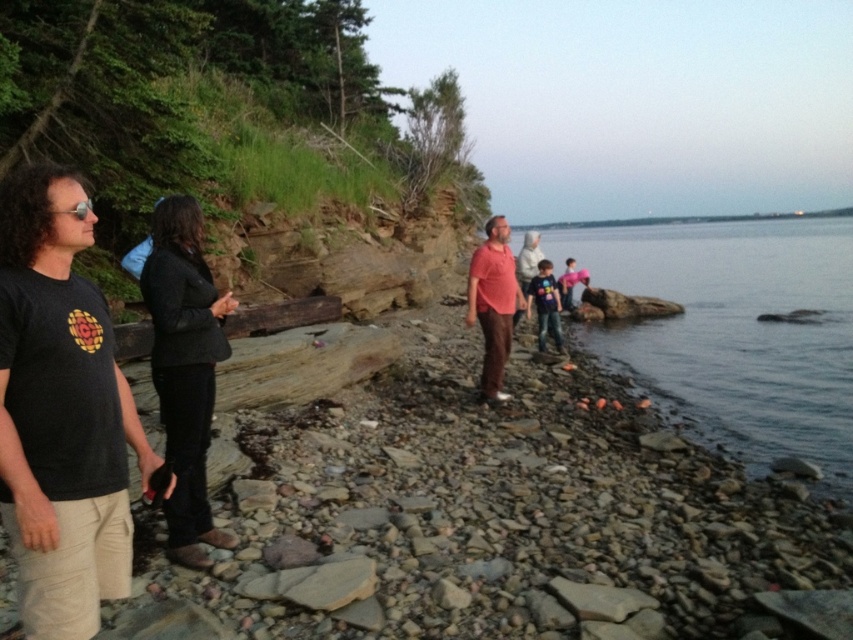
Question: Observing the image, what is the correct spatial positioning of clear water at lower right in reference to black wool jacket at left?

Choices:
 (A) below
 (B) above

Answer: (B)

Question: Which object is closer to the camera taking this photo?

Choices:
 (A) pink fabric at center
 (B) clear water at lower right
 (C) dark blue t-shirt at center
 (D) matte red shirt at center

Answer: (B)

Question: Does black wool jacket at left appear on the right side of pink fabric at center?

Choices:
 (A) yes
 (B) no

Answer: (B)

Question: Among these objects, which one is nearest to the camera?

Choices:
 (A) black matte t-shirt at left
 (B) clear water at lower right
 (C) dark blue t-shirt at center
 (D) pink fabric at center

Answer: (A)

Question: Where is black matte t-shirt at left located in relation to matte red shirt at center in the image?

Choices:
 (A) left
 (B) right

Answer: (A)

Question: Which point is farther to the camera?

Choices:
 (A) dark blue t-shirt at center
 (B) clear water at lower right
 (C) pink fabric at center
 (D) black matte t-shirt at left

Answer: (C)